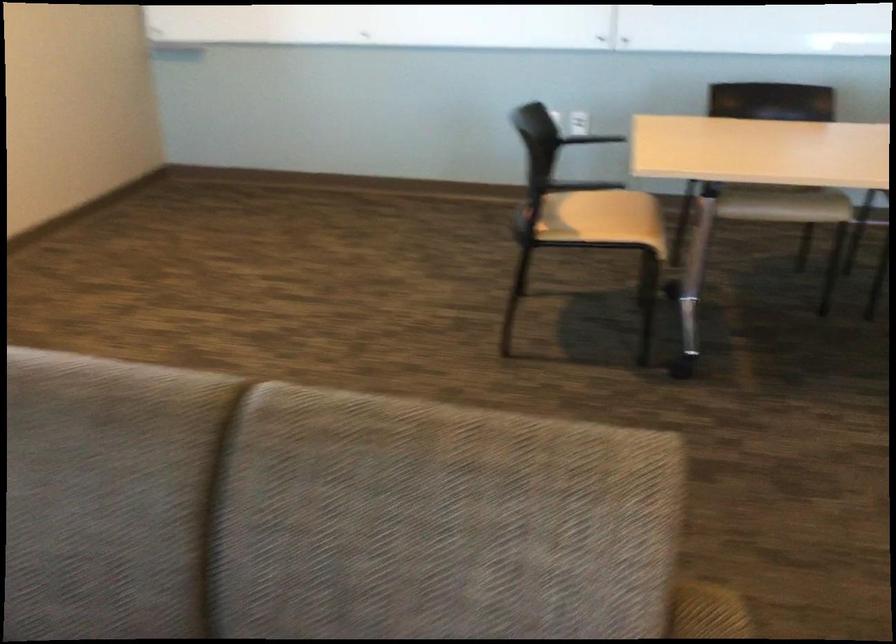
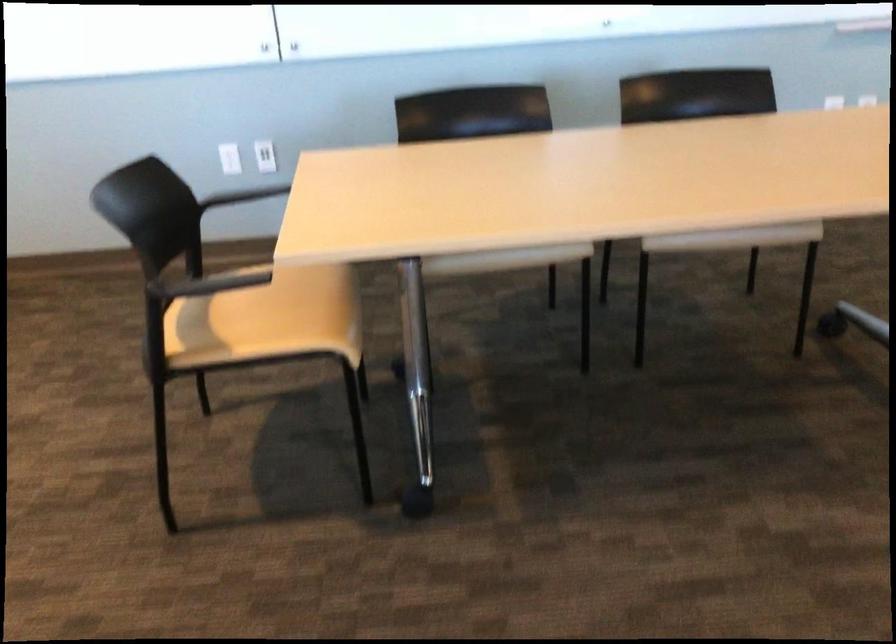
The images are taken continuously from a first-person perspective. In which direction are you moving?

The cameraman moved toward right, forward.